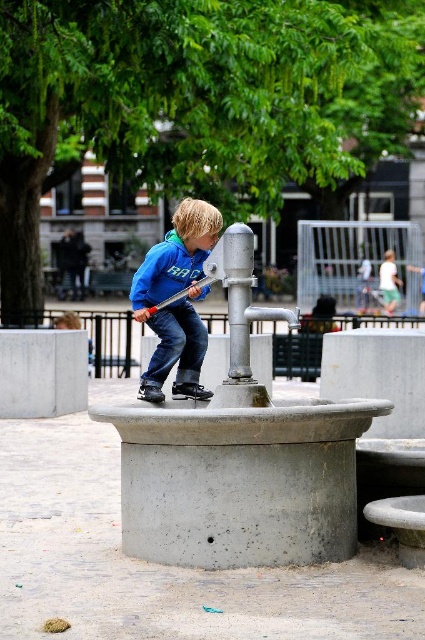
Question: Which point is closer to the camera?

Choices:
 (A) (345, 355)
 (B) (141, 474)
 (C) (391, 275)
 (D) (8, 346)

Answer: (B)

Question: Is gray concrete at center to the left of green cotton shorts at right from the viewer's perspective?

Choices:
 (A) yes
 (B) no

Answer: (A)

Question: Which point is closer to the camera?

Choices:
 (A) (393, 300)
 (B) (176, 358)
 (C) (183, 454)

Answer: (C)

Question: Is concreteroughfountain at center positioned at the back of jeans at center?

Choices:
 (A) no
 (B) yes

Answer: (A)

Question: Which object is farther from the camera taking this photo?

Choices:
 (A) gray concrete at center
 (B) blue fleece jacket at center
 (C) concreteroughfountain at center
 (D) jeans at center

Answer: (A)

Question: Can you confirm if gray concrete at center is positioned to the right of gray concrete at lower left?

Choices:
 (A) yes
 (B) no

Answer: (A)